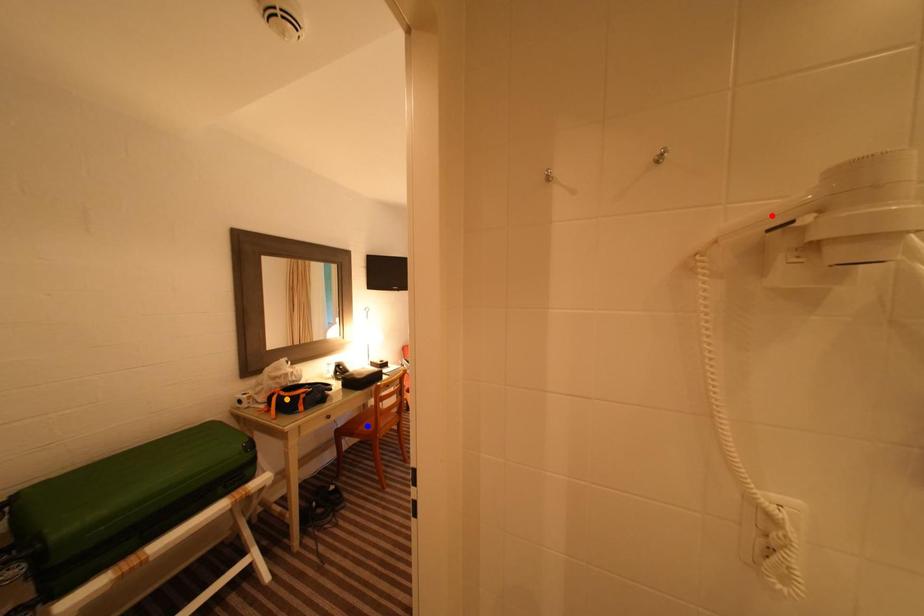
Order these from nearest to farthest:
red point, orange point, blue point

red point → orange point → blue point